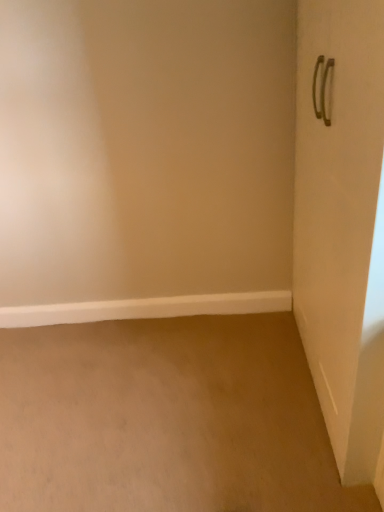
Question: Is metallic silver handle at right spatially inside white smooth baseboard at lower left, or outside of it?

Choices:
 (A) outside
 (B) inside

Answer: (A)

Question: From a real-world perspective, is metallic silver handle at right positioned above or below white smooth baseboard at lower left?

Choices:
 (A) below
 (B) above

Answer: (B)

Question: Considering the relative positions of metallic silver handle at right and white smooth baseboard at lower left in the image provided, is metallic silver handle at right to the left or to the right of white smooth baseboard at lower left?

Choices:
 (A) right
 (B) left

Answer: (A)

Question: Considering their positions, is white smooth baseboard at lower left located in front of or behind metallic silver handle at right?

Choices:
 (A) front
 (B) behind

Answer: (B)

Question: Based on their sizes in the image, would you say white smooth baseboard at lower left is bigger or smaller than metallic silver handle at right?

Choices:
 (A) big
 (B) small

Answer: (B)

Question: From the image's perspective, is white smooth baseboard at lower left located above or below metallic silver handle at right?

Choices:
 (A) below
 (B) above

Answer: (A)

Question: Is point (259, 309) positioned closer to the camera than point (352, 414)?

Choices:
 (A) closer
 (B) farther

Answer: (B)